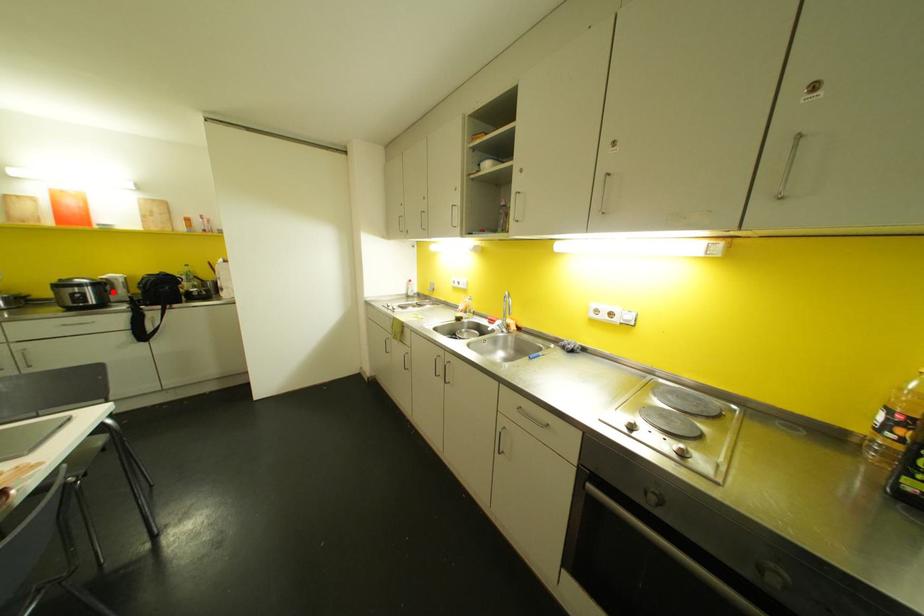
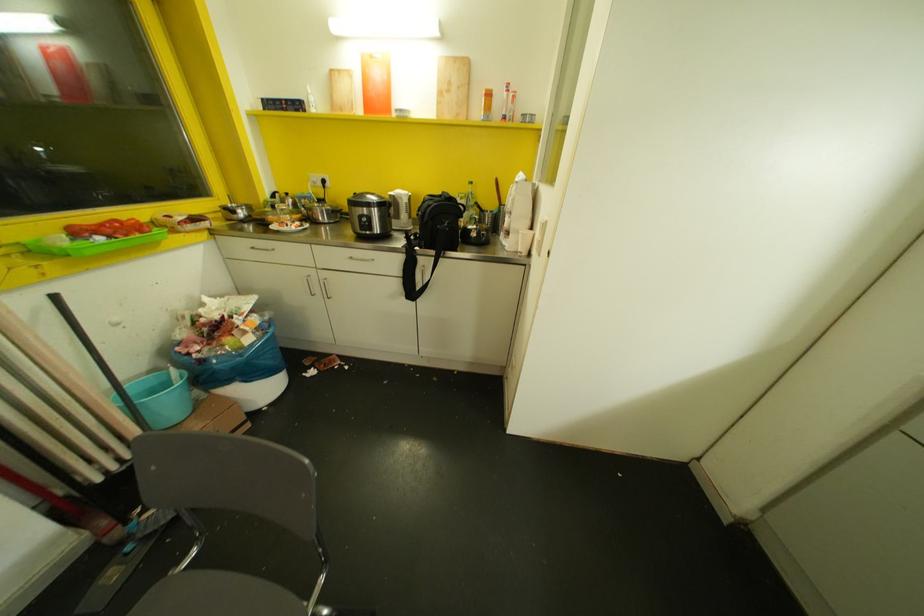
Where in the second image is the point corresponding to the highlighted location from the first image?

(396, 216)